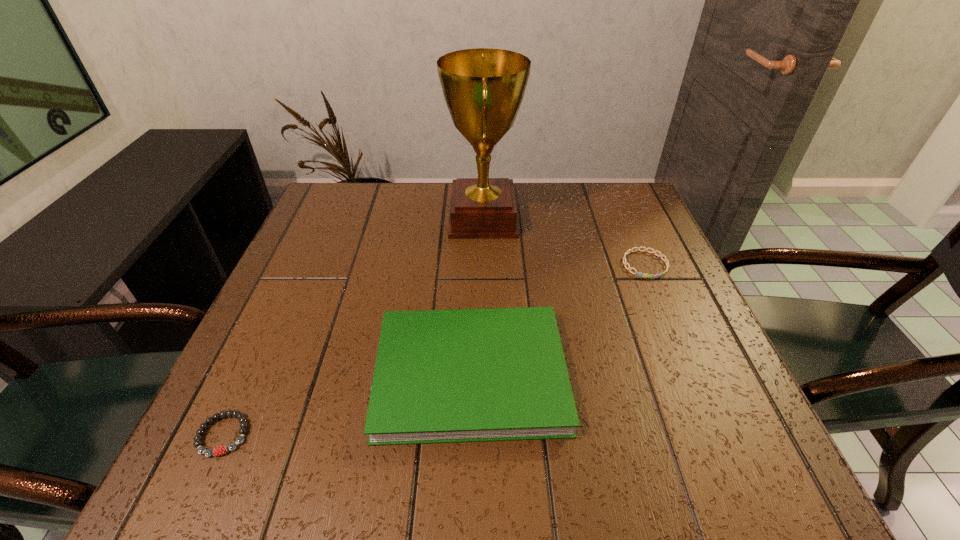
The image size is (960, 540). In order to click on vacant area that lies between the farther bracelet and the tallest object in this screenshot , I will do `click(564, 241)`.

At what (x,y) coordinates should I click in order to perform the action: click on vacant area between the paperback book and the tallest object. Please return your answer as a coordinate pair (x, y). This screenshot has height=540, width=960. Looking at the image, I should click on (477, 296).

Locate which object is the second closest to the tallest object. Please provide its 2D coordinates. Your answer should be formatted as a tuple, i.e. [(x, y)], where the tuple contains the x and y coordinates of a point satisfying the conditions above.

[(666, 261)]

Where is `the third closest object to the left bracelet`? This screenshot has width=960, height=540. the third closest object to the left bracelet is located at coordinates (666, 261).